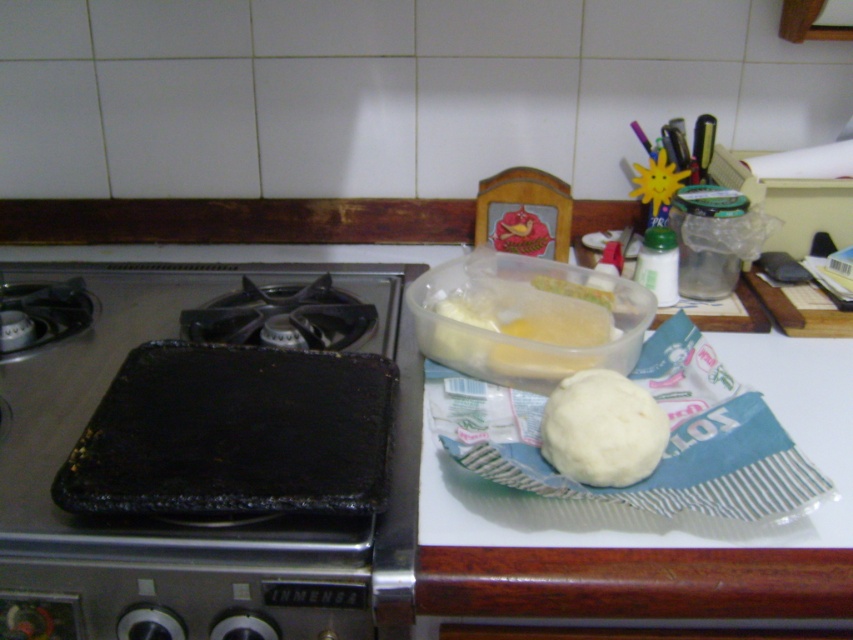
You are preparing to place both the translucent plastic container at center and the white matte dough at center into a rectangular storage box. The box can only fit one of them. Which object should you choose to ensure it fits?

The white matte dough at center is smaller than the translucent plastic container at center, so the white matte dough at center should be chosen to ensure it fits into the storage box.